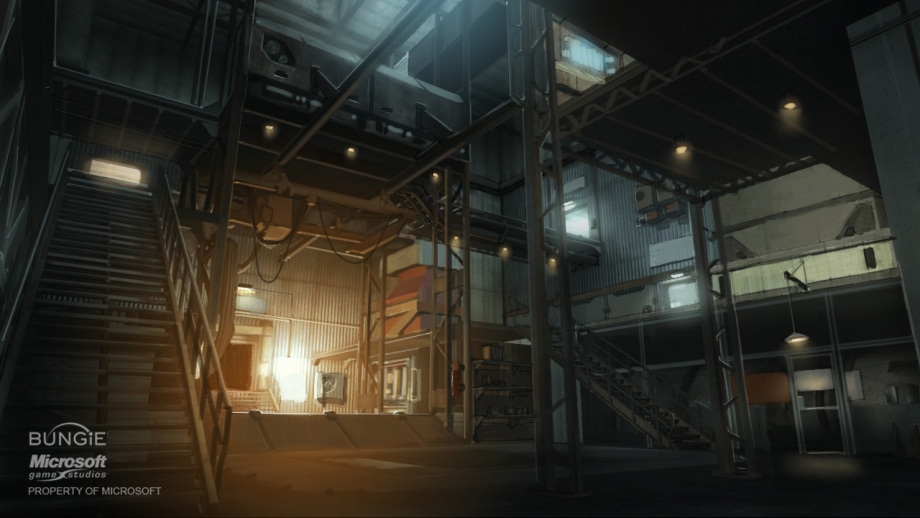
You are a GUI agent. You are given a task and a screenshot of the screen. Output one action in this format:
    pyautogui.click(x=<x>, y=<y>)
    Task: Click on the corridor
    Image resolution: width=920 pixels, height=518 pixels.
    Given the screenshot: What is the action you would take?
    pyautogui.click(x=231, y=357)